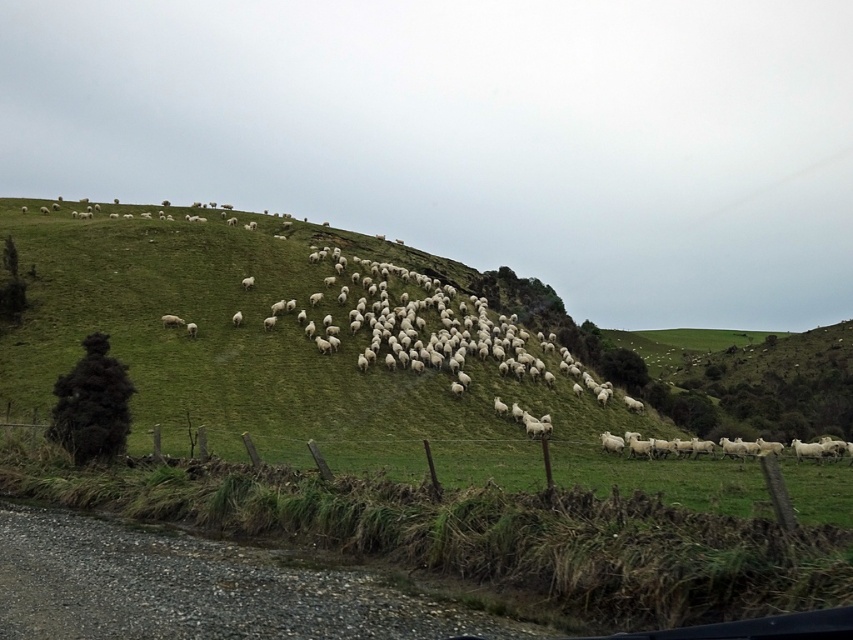
Question: Observing the image, what is the correct spatial positioning of wooden posts at lower left in reference to white woolly sheep at center-left?

Choices:
 (A) left
 (B) right

Answer: (B)

Question: In this image, where is wooden posts at lower left located relative to white woolly sheep at center-left?

Choices:
 (A) right
 (B) left

Answer: (A)

Question: Which object is farther from the camera taking this photo?

Choices:
 (A) wooden posts at lower left
 (B) white woolly sheep at center-left

Answer: (B)

Question: In this image, where is wooden posts at lower left located relative to white woolly sheep at center-left?

Choices:
 (A) below
 (B) above

Answer: (A)